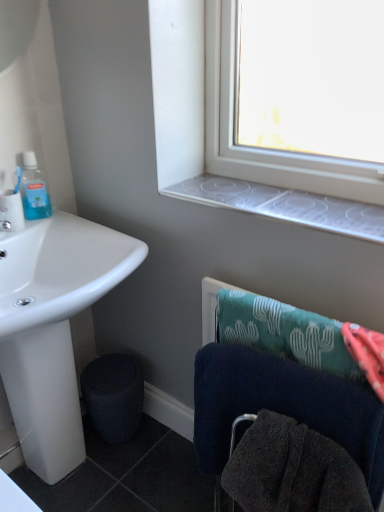
Question: Considering the relative sizes of clear plastic window sill at upper center and white glossy sink at lower left in the image provided, is clear plastic window sill at upper center taller than white glossy sink at lower left?

Choices:
 (A) no
 (B) yes

Answer: (A)

Question: Is clear plastic window sill at upper center closer to the viewer compared to white glossy sink at lower left?

Choices:
 (A) yes
 (B) no

Answer: (B)

Question: Can you confirm if clear plastic window sill at upper center is thinner than white glossy sink at lower left?

Choices:
 (A) no
 (B) yes

Answer: (B)

Question: From the image's perspective, would you say clear plastic window sill at upper center is positioned over white glossy sink at lower left?

Choices:
 (A) yes
 (B) no

Answer: (A)

Question: Is clear plastic window sill at upper center not close to white glossy sink at lower left?

Choices:
 (A) no
 (B) yes

Answer: (A)

Question: Can you confirm if clear plastic window sill at upper center is positioned to the right of white glossy sink at lower left?

Choices:
 (A) no
 (B) yes

Answer: (B)

Question: Considering the relative sizes of translucent plastic mouthwash at upper left and white glossy sink at lower left in the image provided, is translucent plastic mouthwash at upper left thinner than white glossy sink at lower left?

Choices:
 (A) no
 (B) yes

Answer: (B)

Question: From a real-world perspective, is translucent plastic mouthwash at upper left over white glossy sink at lower left?

Choices:
 (A) no
 (B) yes

Answer: (B)

Question: Can you confirm if translucent plastic mouthwash at upper left is wider than white glossy sink at lower left?

Choices:
 (A) yes
 (B) no

Answer: (B)

Question: From the image's perspective, does translucent plastic mouthwash at upper left appear higher than white glossy sink at lower left?

Choices:
 (A) no
 (B) yes

Answer: (B)

Question: Is translucent plastic mouthwash at upper left not close to white glossy sink at lower left?

Choices:
 (A) yes
 (B) no

Answer: (B)

Question: Can you confirm if translucent plastic mouthwash at upper left is taller than white glossy sink at lower left?

Choices:
 (A) no
 (B) yes

Answer: (A)

Question: Is clear plastic window sill at upper center not inside dark blue towel at lower right?

Choices:
 (A) yes
 (B) no

Answer: (A)